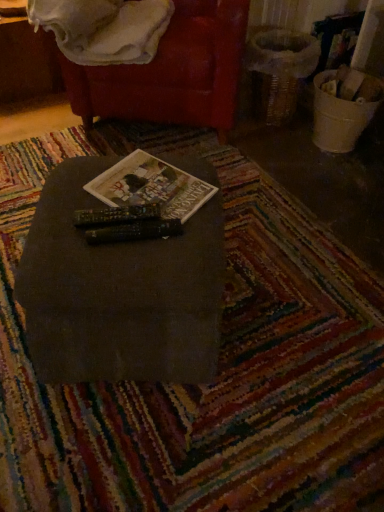
Question: Would you say hardcover book at center is inside or outside matte black table at center?

Choices:
 (A) outside
 (B) inside

Answer: (B)

Question: Considering the positions of hardcover book at center and matte black table at center in the image, is hardcover book at center wider or thinner than matte black table at center?

Choices:
 (A) wide
 (B) thin

Answer: (B)

Question: Which object is positioned farthest from the matte black table at center?

Choices:
 (A) white soft blanket at upper left
 (B) velvet red bean bag chair at upper center
 (C) hardcover book at center

Answer: (A)

Question: Based on their relative distances, which object is farther from the matte black table at center?

Choices:
 (A) velvet red bean bag chair at upper center
 (B) hardcover book at center
 (C) white soft blanket at upper left

Answer: (C)